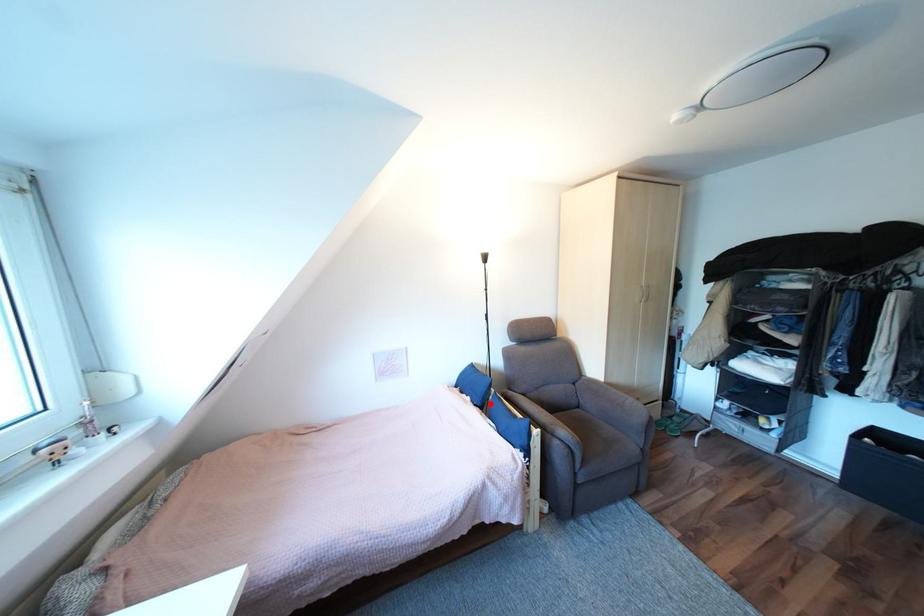
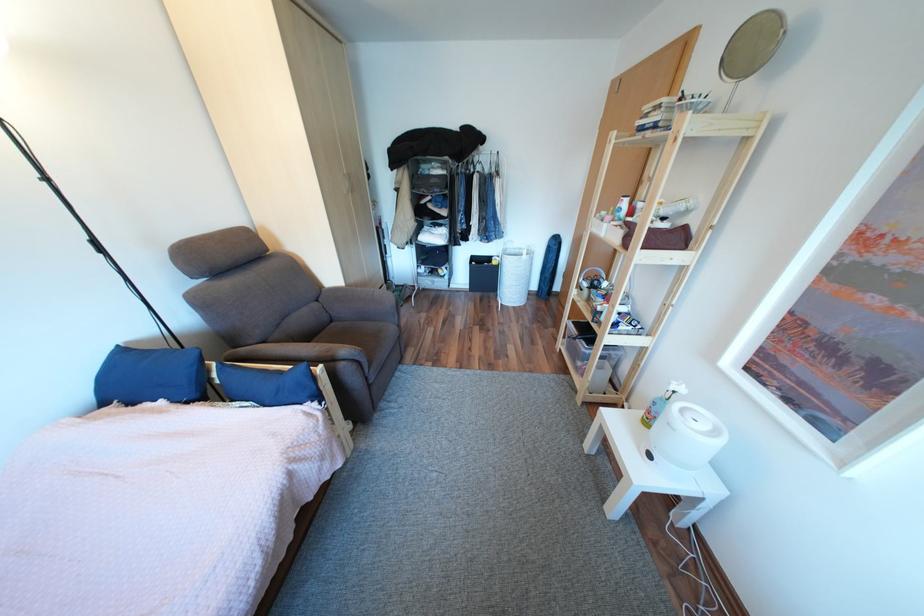
In the second image, find the point that corresponds to the highlighted location in the first image.

(205, 395)